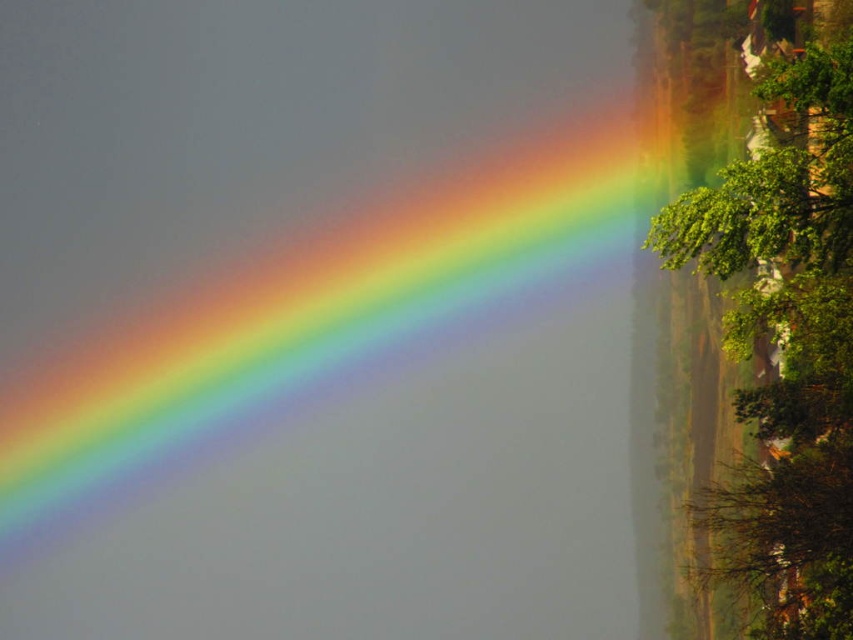
This screenshot has height=640, width=853. What do you see at coordinates (322, 310) in the screenshot? I see `rainbow at upper left` at bounding box center [322, 310].

Can you confirm if rainbow at upper left is positioned below green leafy tree at upper right?

No.

At what (x,y) coordinates should I click in order to perform the action: click on rainbow at upper left. Please return your answer as a coordinate pair (x, y). The width and height of the screenshot is (853, 640). Looking at the image, I should click on (322, 310).